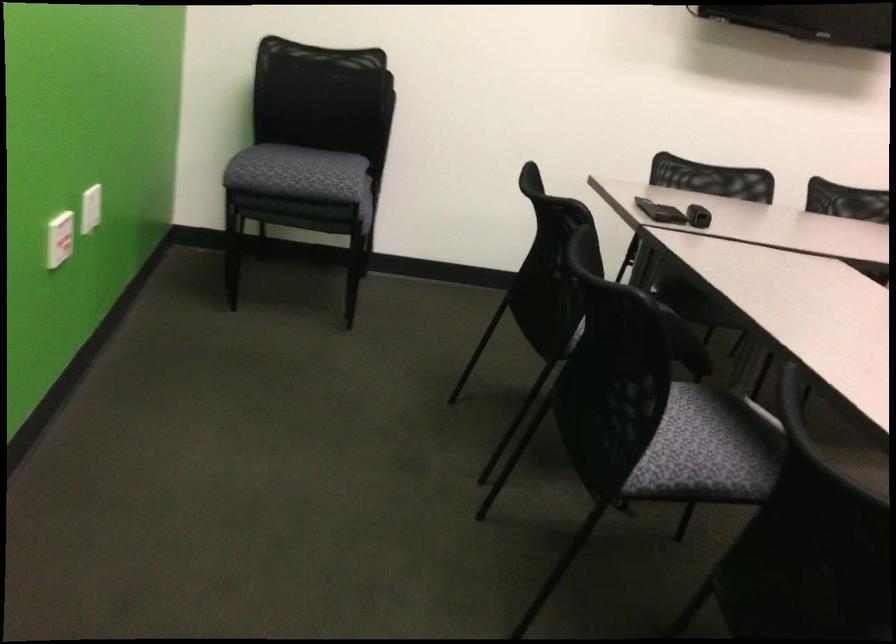
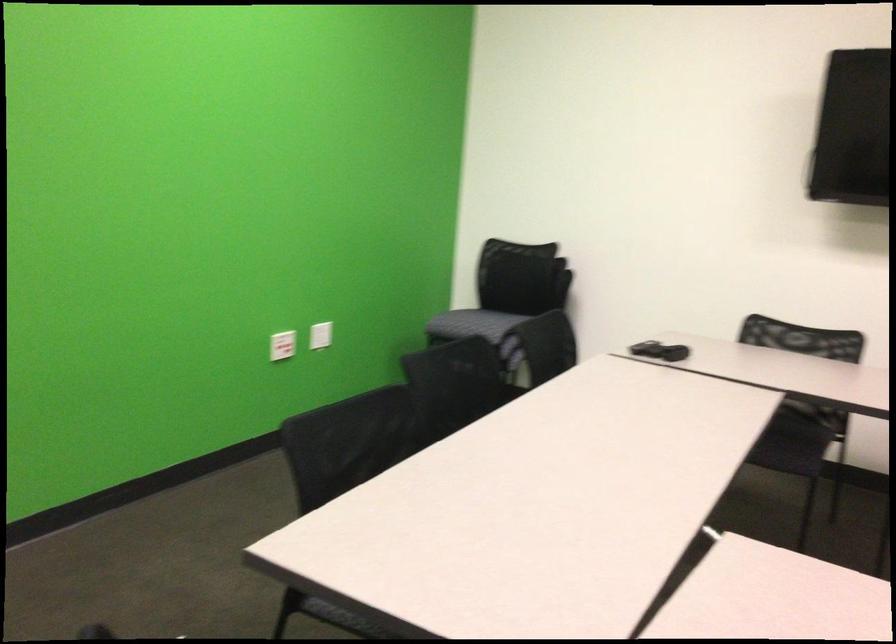
Find the pixel in the second image that matches (x=328, y=192) in the first image.

(471, 324)